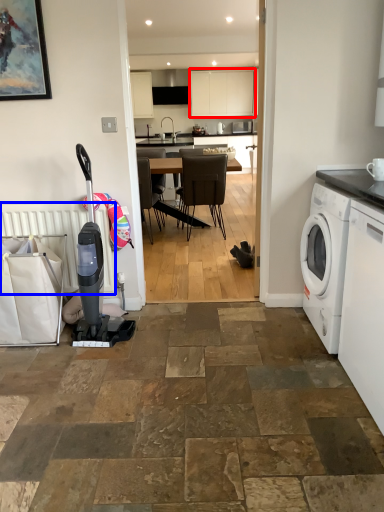
Question: Which point is closer to the camera, cabinetry (highlighted by a red box) or radiator (highlighted by a blue box)?

Choices:
 (A) cabinetry
 (B) radiator

Answer: (B)